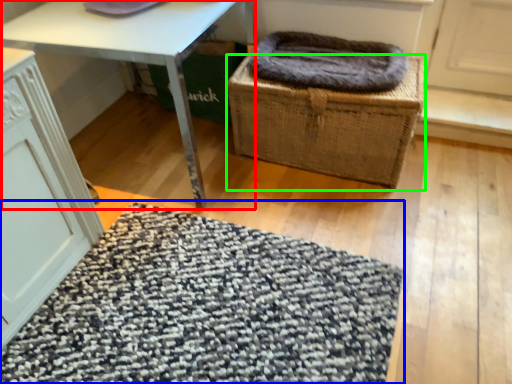
Question: Which object is positioned closest to table (highlighted by a red box)? Select from mat (highlighted by a blue box) and basket (highlighted by a green box).

Choices:
 (A) mat
 (B) basket

Answer: (B)